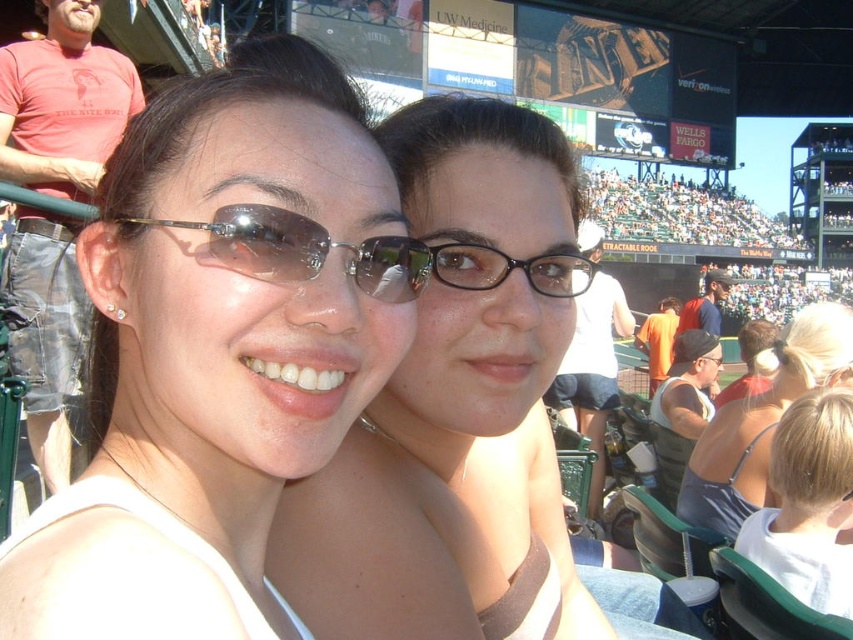
You are a photographer at the baseball stadium. You want to take a closeup shot of the pearl earrings at left and the matte black glasses at center. Which object should you zoom in more on to ensure both are in focus?

The matte black glasses at center is larger in size compared to pearl earrings at left, so you should zoom in more on the pearl earrings at left to ensure both are in focus.

You are a photographer at the baseball stadium and want to capture a closeup of the matte black glasses at center. Where should you aim your camera to get the best shot?

The matte black glasses at center are located at point 0.752 on the x axis and 0.517 on the y axis, so aim your camera at those coordinates for the best shot.

Looking at this image, you are at a baseball stadium and want to throw a baseball to someone standing at the matte white tank top at center. If you can throw the ball 30 meters, will you be able to reach them?

The matte white tank top at center is 29.37 meters from viewer. Since you can throw the ball 30 meters, you can reach them.